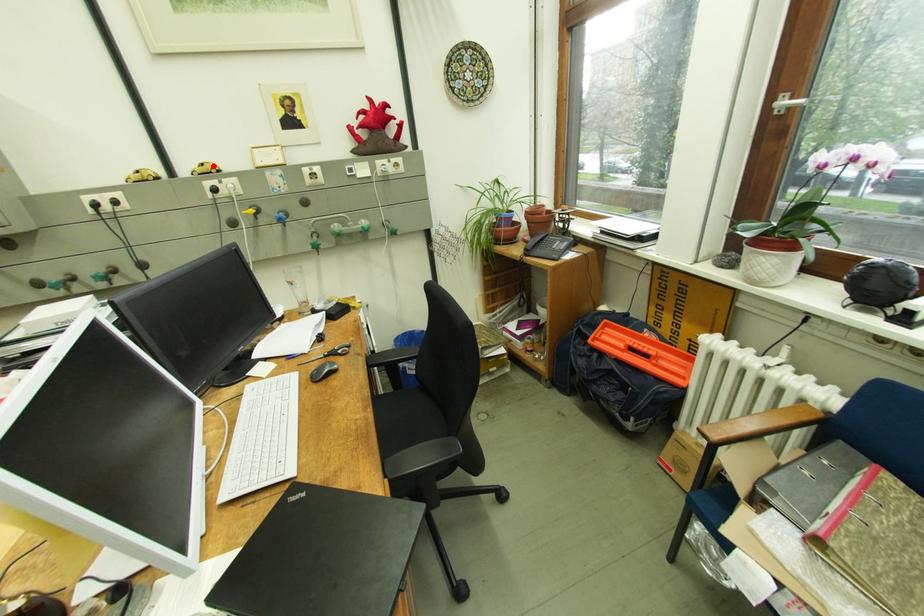
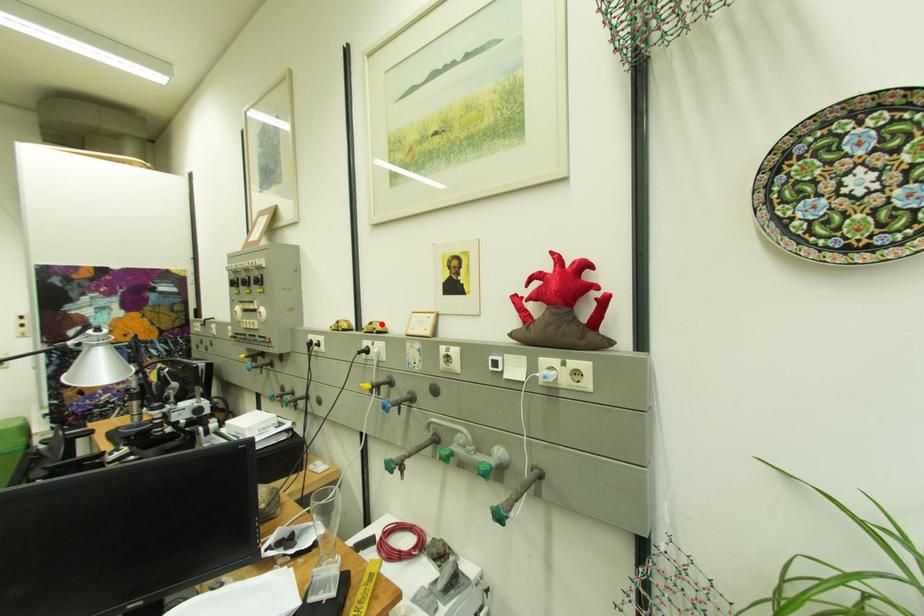
I am providing you with two images of the same scene from different viewpoints. A red point is marked on the first image and another point is marked on the second image. Is the red point in image1 aligned with the point shown in image2?

Yes